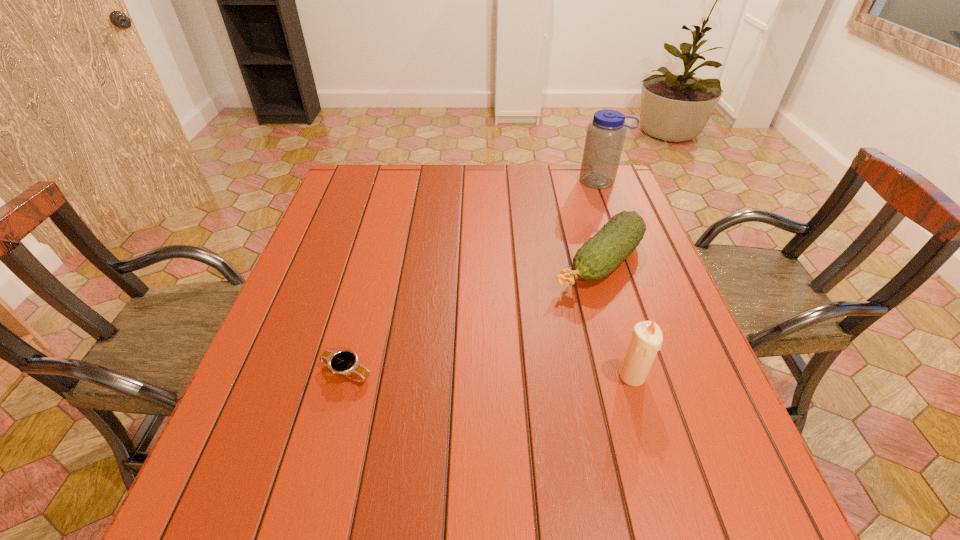
The width and height of the screenshot is (960, 540). Find the location of `object present at the far right corner`. object present at the far right corner is located at coordinates (605, 136).

Locate an element on the screen. The height and width of the screenshot is (540, 960). blank area at the far edge is located at coordinates (543, 188).

Image resolution: width=960 pixels, height=540 pixels. What are the coordinates of `vacant space at the near edge` in the screenshot? It's located at (533, 434).

At what (x,y) coordinates should I click in order to perform the action: click on free point at the left edge. Please return your answer as a coordinate pair (x, y). Looking at the image, I should click on (300, 357).

The image size is (960, 540). Find the location of `vacant space at the right edge of the desktop`. vacant space at the right edge of the desktop is located at coordinates click(651, 258).

This screenshot has width=960, height=540. Find the location of `vacant space at the far left corner of the desktop`. vacant space at the far left corner of the desktop is located at coordinates (346, 165).

Image resolution: width=960 pixels, height=540 pixels. Identify the location of blank space at the near left corner. (230, 435).

Identify the location of free area in between the watch and the second farthest object. This screenshot has height=540, width=960. (472, 317).

Identify the location of free space between the farthest object and the third tallest object. (599, 221).

Identify the location of unoccupied position between the second shortest object and the watch. This screenshot has height=540, width=960. [472, 317].